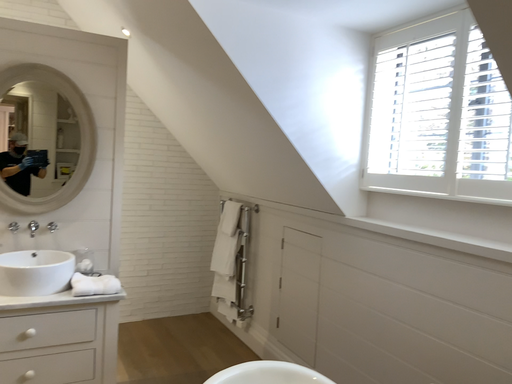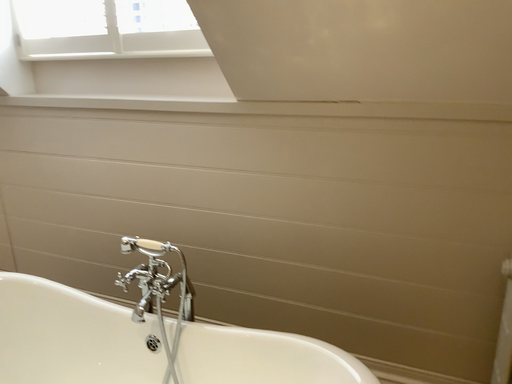
Question: Which way did the camera rotate in the video?

Choices:
 (A) rotated left
 (B) rotated right

Answer: (B)